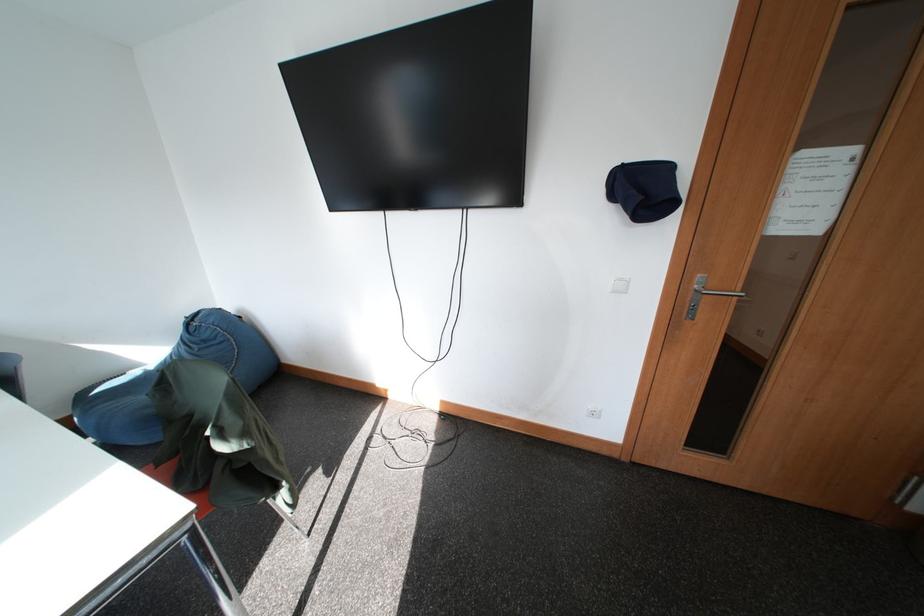
Where would you turn the silver door handle? Please return your answer as a coordinate pair (x, y).

(712, 289)